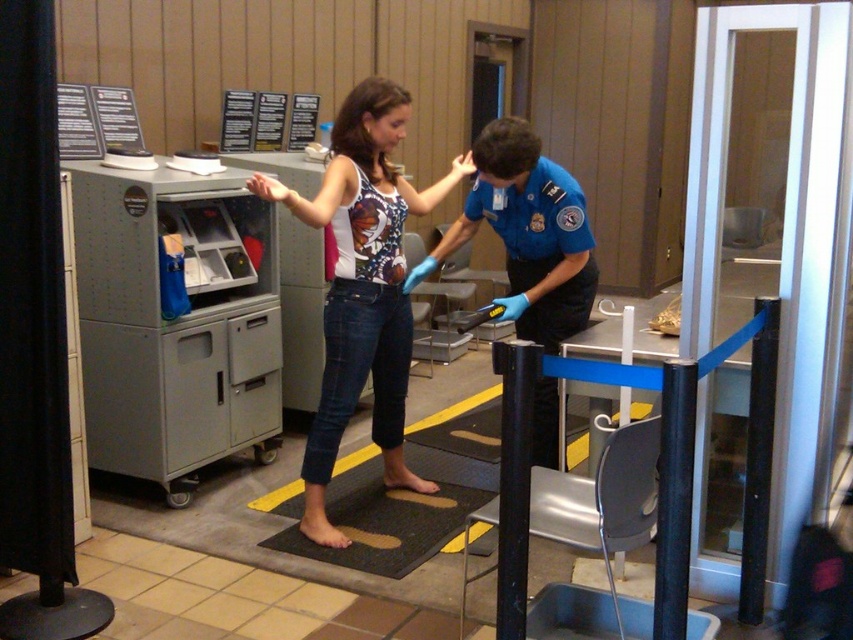
Question: Does matte white tank top at center appear under blue uniform at center?

Choices:
 (A) yes
 (B) no

Answer: (A)

Question: Is matte white tank top at center behind blue uniform at center?

Choices:
 (A) no
 (B) yes

Answer: (A)

Question: Is matte white tank top at center to the right of blue uniform at center from the viewer's perspective?

Choices:
 (A) yes
 (B) no

Answer: (B)

Question: Which object is farther from the camera taking this photo?

Choices:
 (A) matte white tank top at center
 (B) blue uniform at center

Answer: (B)

Question: Among these objects, which one is nearest to the camera?

Choices:
 (A) blue uniform at center
 (B) matte white tank top at center

Answer: (B)